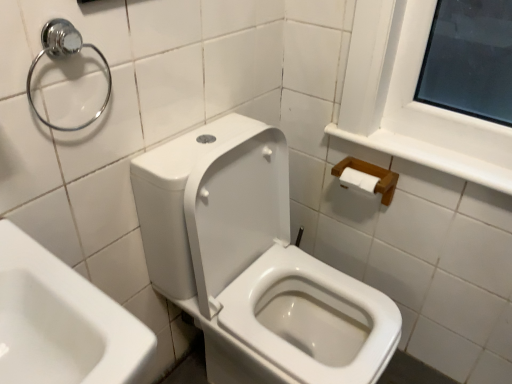
Question: Considering the positions of wooden tissue holder at upper right and chrome metallic towel ring at upper left in the image, is wooden tissue holder at upper right bigger or smaller than chrome metallic towel ring at upper left?

Choices:
 (A) big
 (B) small

Answer: (A)

Question: Relative to chrome metallic towel ring at upper left, is wooden tissue holder at upper right in front or behind?

Choices:
 (A) front
 (B) behind

Answer: (B)

Question: Which of these objects is positioned farthest from the white glossy toilet at center?

Choices:
 (A) wooden tissue holder at upper right
 (B) chrome metallic towel ring at upper left

Answer: (B)

Question: Which object is positioned farthest from the chrome metallic towel ring at upper left?

Choices:
 (A) white glossy toilet at center
 (B) wooden tissue holder at upper right

Answer: (B)